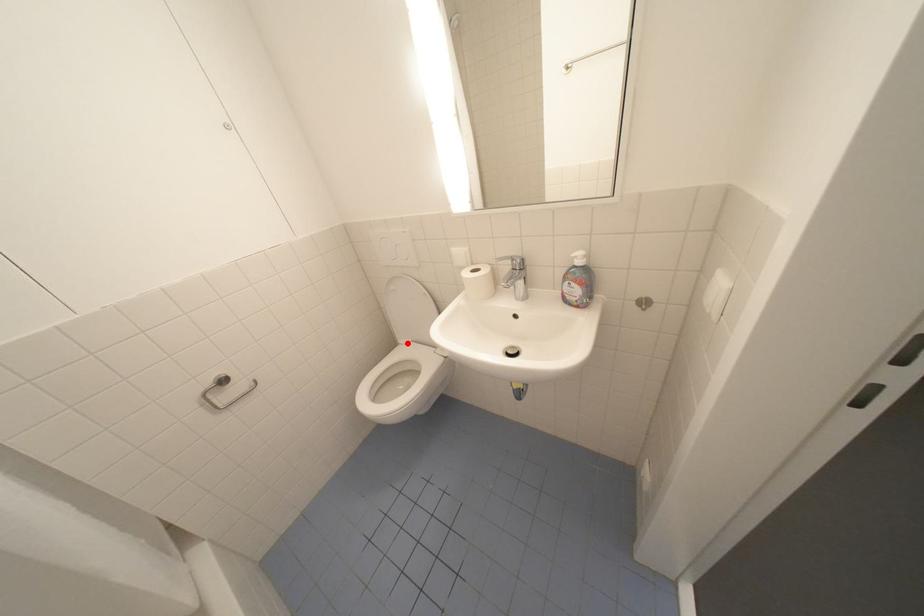
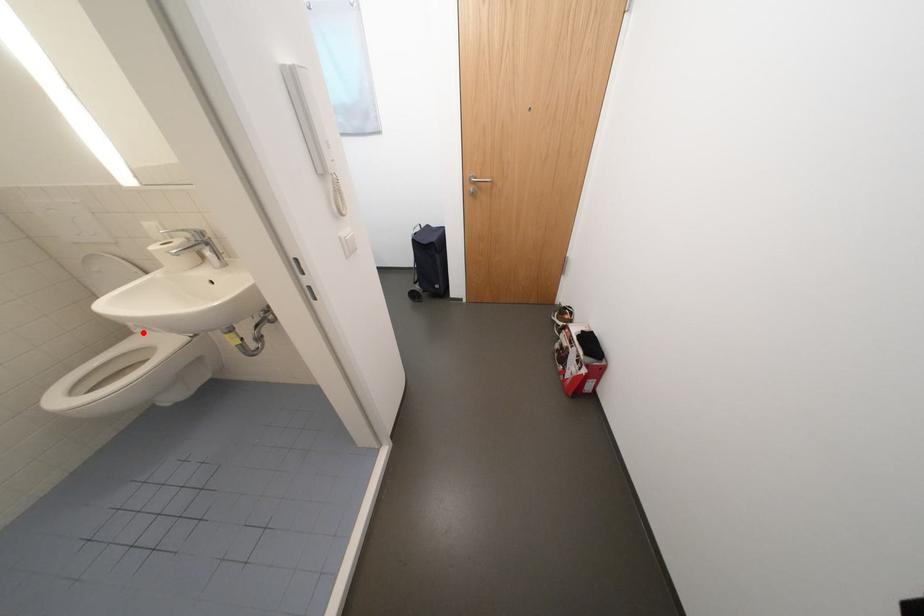
I am providing you with two images of the same scene from different viewpoints. A red point is marked on the first image and another point is marked on the second image. Does the point marked in image1 correspond to the same location as the one in image2?

Yes